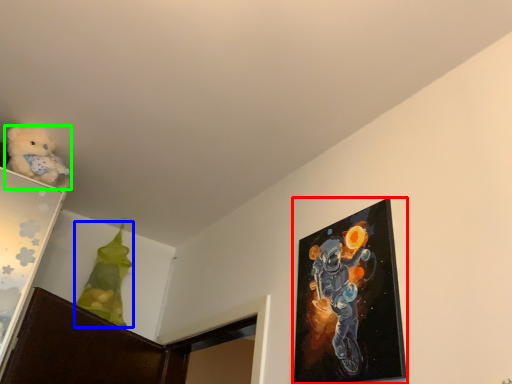
Question: Which object is the farthest from picture frame (highlighted by a red box)? Choose among these: toy (highlighted by a blue box) or teddy bear (highlighted by a green box).

Choices:
 (A) toy
 (B) teddy bear

Answer: (A)